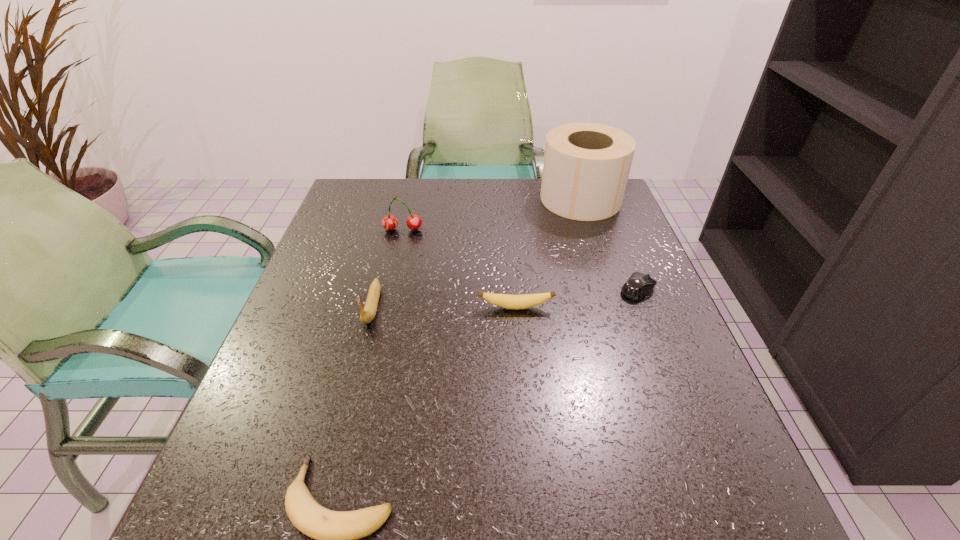
The height and width of the screenshot is (540, 960). I want to click on unoccupied area between the cherry and the third object from right to left, so click(x=459, y=268).

Locate which object ranks second in proximity to the nearest object. Please provide its 2D coordinates. Your answer should be formatted as a tuple, i.e. [(x, y)], where the tuple contains the x and y coordinates of a point satisfying the conditions above.

[(524, 301)]

Where is `object that is the fourth nearest to the third shortest object`? The height and width of the screenshot is (540, 960). object that is the fourth nearest to the third shortest object is located at coordinates (586, 166).

Identify the location of banana identified as the closest to the third shortest object. (368, 313).

Identify which banana is located as the nearest to the third shortest object. Please provide its 2D coordinates. Your answer should be formatted as a tuple, i.e. [(x, y)], where the tuple contains the x and y coordinates of a point satisfying the conditions above.

[(368, 313)]

Find the location of a particular element. Image resolution: width=960 pixels, height=540 pixels. free space that satisfies the following two spatial constraints: 1. with stems pointing upwards on the rightmost banana; 2. on the left side of the fifth nearest object is located at coordinates (385, 307).

Identify the location of vacant region that satisfies the following two spatial constraints: 1. on the back side of the third shortest object; 2. on the left side of the mouse. (515, 289).

What are the coordinates of `free region that satisfies the following two spatial constraints: 1. at the stem of the fourth tallest object; 2. on the right side of the tallest banana` in the screenshot? It's located at (372, 307).